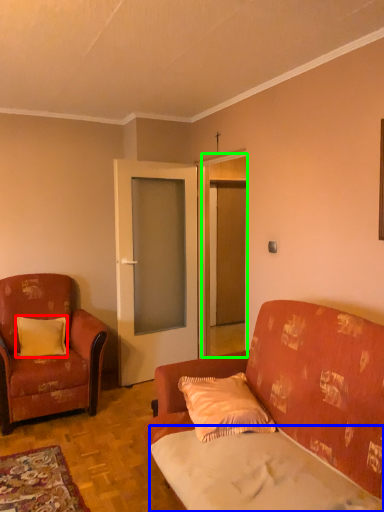
Question: Which object is positioned farthest from pillow (highlighted by a red box)? Select from sheet (highlighted by a blue box) and door (highlighted by a green box).

Choices:
 (A) sheet
 (B) door

Answer: (A)